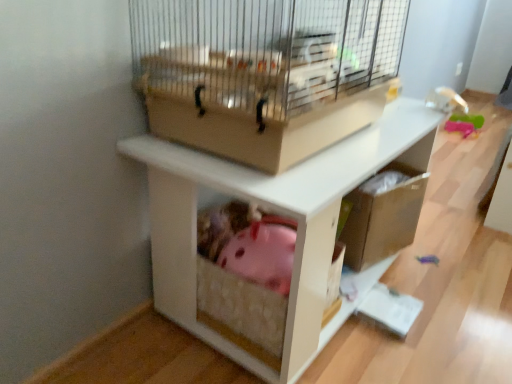
The height and width of the screenshot is (384, 512). I want to click on beige wire mesh bird cage at upper center, so click(x=264, y=72).

What do you see at coordinates (264, 72) in the screenshot? I see `beige wire mesh bird cage at upper center` at bounding box center [264, 72].

Describe the element at coordinates (281, 214) in the screenshot. The width and height of the screenshot is (512, 384). I see `white matte shelf at center` at that location.

This screenshot has width=512, height=384. In order to click on white matte shelf at center in this screenshot , I will do `click(281, 214)`.

I want to click on beige wire mesh bird cage at upper center, so click(x=264, y=72).

Which object is positioned more to the left, beige wire mesh bird cage at upper center or white matte shelf at center?

beige wire mesh bird cage at upper center.

Which is in front, beige wire mesh bird cage at upper center or white matte shelf at center?

beige wire mesh bird cage at upper center is closer to the camera.

Considering the positions of points (334, 126) and (412, 147), is point (334, 126) farther from camera compared to point (412, 147)?

No, (334, 126) is closer to viewer.

From the image's perspective, is beige wire mesh bird cage at upper center located above white matte shelf at center?

Yes.

From a real-world perspective, which is physically above, beige wire mesh bird cage at upper center or white matte shelf at center?

From a 3D spatial view, beige wire mesh bird cage at upper center is above.

Does beige wire mesh bird cage at upper center have a lesser width compared to white matte shelf at center?

Indeed, beige wire mesh bird cage at upper center has a lesser width compared to white matte shelf at center.

Who is shorter, beige wire mesh bird cage at upper center or white matte shelf at center?

With less height is beige wire mesh bird cage at upper center.

Who is smaller, beige wire mesh bird cage at upper center or white matte shelf at center?

Answer: With smaller size is beige wire mesh bird cage at upper center.

Based on the photo, is beige wire mesh bird cage at upper center outside of white matte shelf at center?

Absolutely, beige wire mesh bird cage at upper center is external to white matte shelf at center.

Is beige wire mesh bird cage at upper center in contact with white matte shelf at center?

No, beige wire mesh bird cage at upper center is not next to white matte shelf at center.

Is beige wire mesh bird cage at upper center looking in the opposite direction of white matte shelf at center?

No, beige wire mesh bird cage at upper center is not facing the opposite direction of white matte shelf at center.

How distant is beige wire mesh bird cage at upper center from white matte shelf at center?

6.39 inches.

Find the location of `shelf that is under the beige wire mesh bird cage at upper center (from a real-world perspective)`. shelf that is under the beige wire mesh bird cage at upper center (from a real-world perspective) is located at coordinates (281, 214).

Is white matte shelf at center to the right of beige wire mesh bird cage at upper center from the viewer's perspective?

Yes, white matte shelf at center is to the right of beige wire mesh bird cage at upper center.

Which object is closer to the camera taking this photo, white matte shelf at center or beige wire mesh bird cage at upper center?

beige wire mesh bird cage at upper center is closer to the camera.

Between point (310, 321) and point (364, 62), which one is positioned behind?

The point (364, 62) is farther.

From the image's perspective, is white matte shelf at center positioned above or below beige wire mesh bird cage at upper center?

white matte shelf at center is situated lower than beige wire mesh bird cage at upper center in the image.

From a real-world perspective, is white matte shelf at center positioned over beige wire mesh bird cage at upper center based on gravity?

No, from a real-world perspective, white matte shelf at center is not over beige wire mesh bird cage at upper center

Which of these two, white matte shelf at center or beige wire mesh bird cage at upper center, is thinner?

With smaller width is beige wire mesh bird cage at upper center.

Considering the sizes of white matte shelf at center and beige wire mesh bird cage at upper center in the image, is white matte shelf at center taller or shorter than beige wire mesh bird cage at upper center?

Clearly, white matte shelf at center is taller compared to beige wire mesh bird cage at upper center.

Between white matte shelf at center and beige wire mesh bird cage at upper center, which one has smaller size?

beige wire mesh bird cage at upper center.

Can we say white matte shelf at center lies outside beige wire mesh bird cage at upper center?

Absolutely, white matte shelf at center is external to beige wire mesh bird cage at upper center.

Is white matte shelf at center next to beige wire mesh bird cage at upper center and touching it?

white matte shelf at center is not next to beige wire mesh bird cage at upper center, and they're not touching.

Is white matte shelf at center turned away from beige wire mesh bird cage at upper center?

No, white matte shelf at center is not facing away from beige wire mesh bird cage at upper center.

Measure the distance from white matte shelf at center to beige wire mesh bird cage at upper center.

The distance of white matte shelf at center from beige wire mesh bird cage at upper center is 6.39 inches.

Find the location of a particular element. The width and height of the screenshot is (512, 384). bird cage located above the white matte shelf at center (from the image's perspective) is located at coordinates (264, 72).

There is a white matte shelf at center. What are the coordinates of `bird cage above it (from a real-world perspective)` in the screenshot? It's located at (264, 72).

You are a GUI agent. You are given a task and a screenshot of the screen. Output one action in this format:
    pyautogui.click(x=<x>, y=<y>)
    Task: Click on the shelf that appears behind the beige wire mesh bird cage at upper center
    
    Given the screenshot: What is the action you would take?
    pyautogui.click(x=281, y=214)